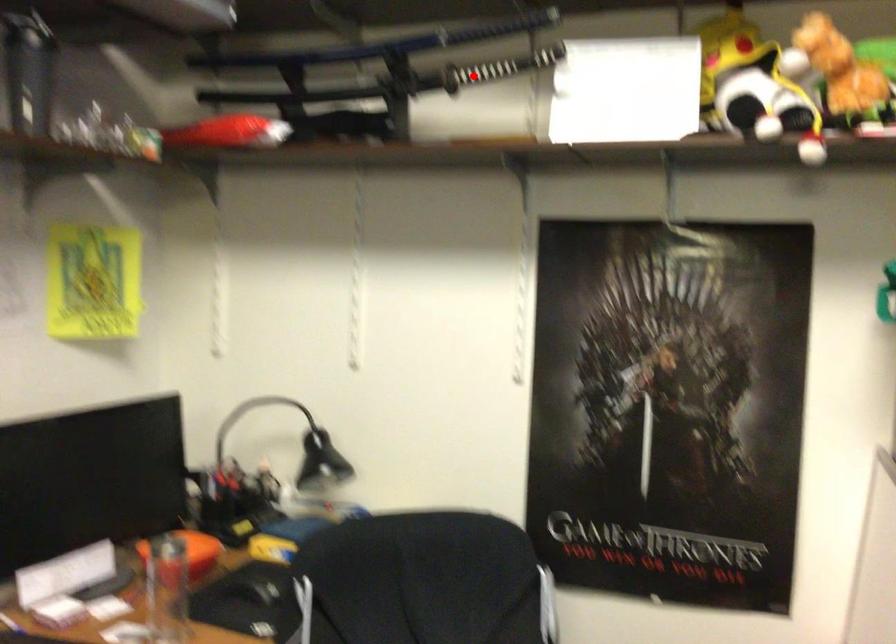
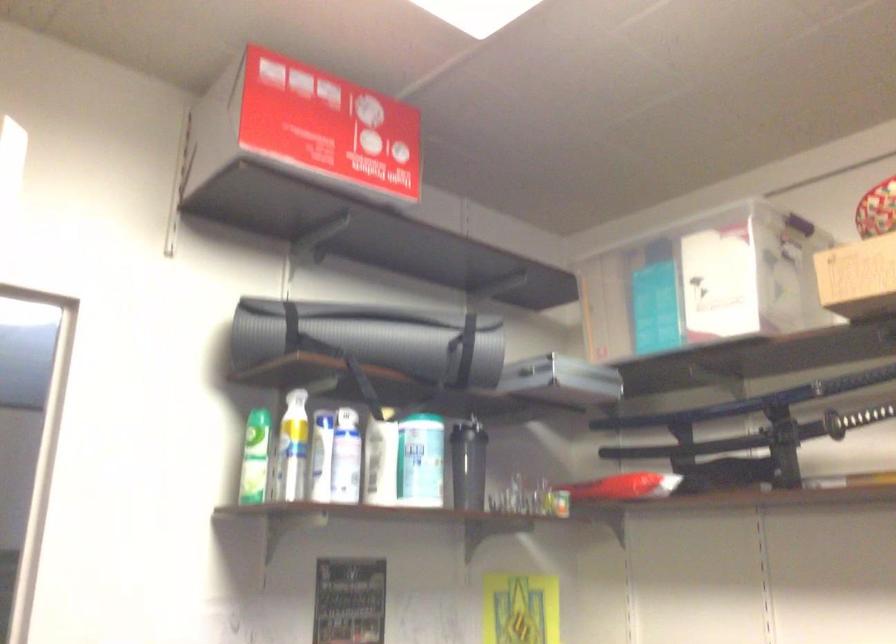
Where in the second image is the point corresponding to the highlighted location from the first image?

(855, 419)